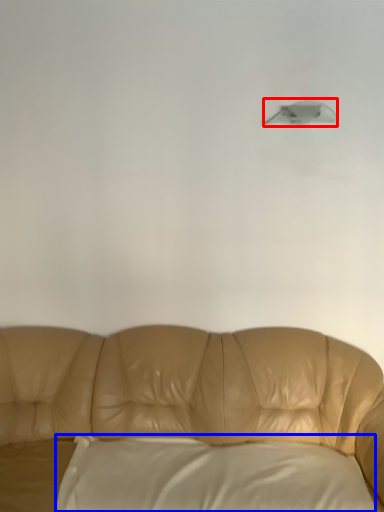
Question: Which object appears closest to the camera in this image, lamp (highlighted by a red box) or pillow (highlighted by a blue box)?

Choices:
 (A) lamp
 (B) pillow

Answer: (B)